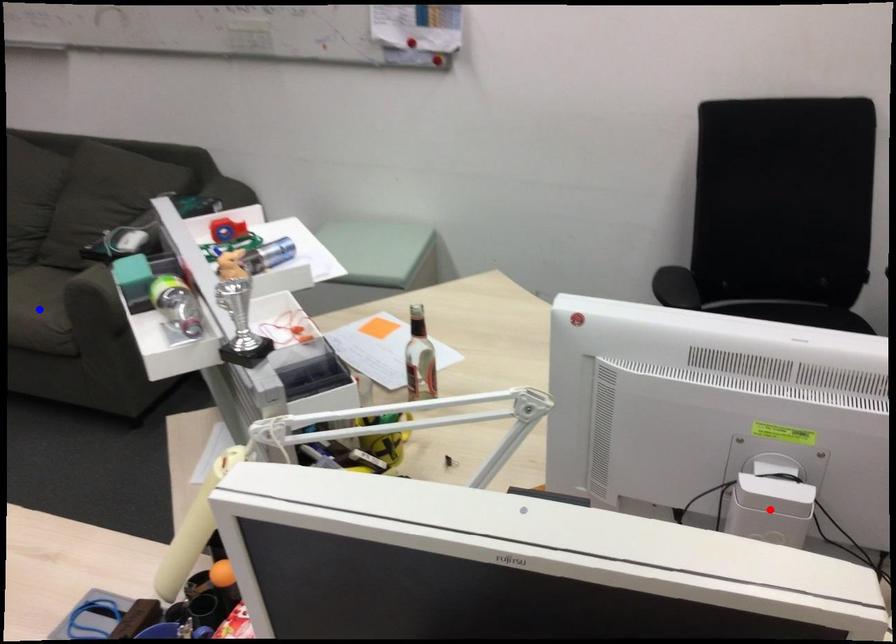
Question: Which of the two points in the image is closer to the camera?

Choices:
 (A) Blue point is closer.
 (B) Red point is closer.

Answer: (B)